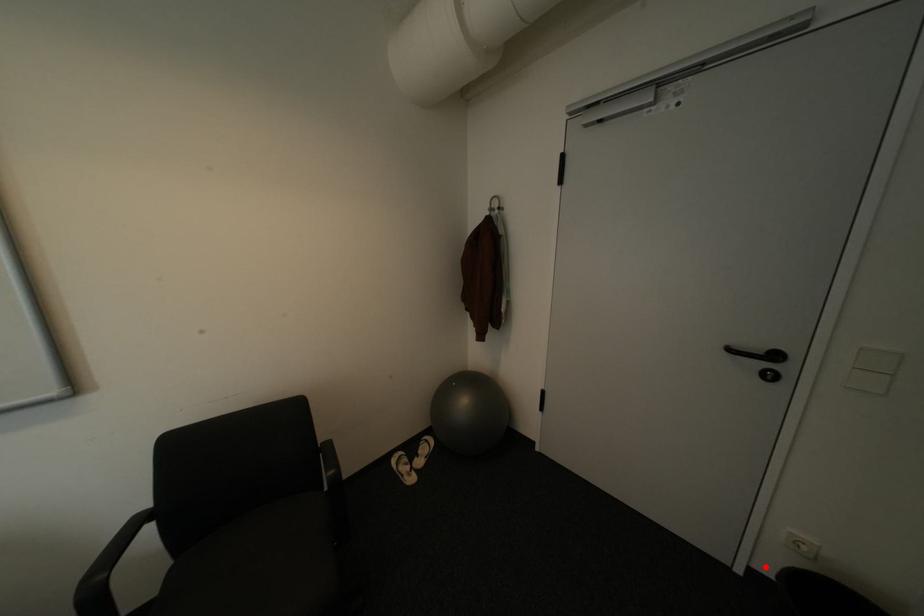
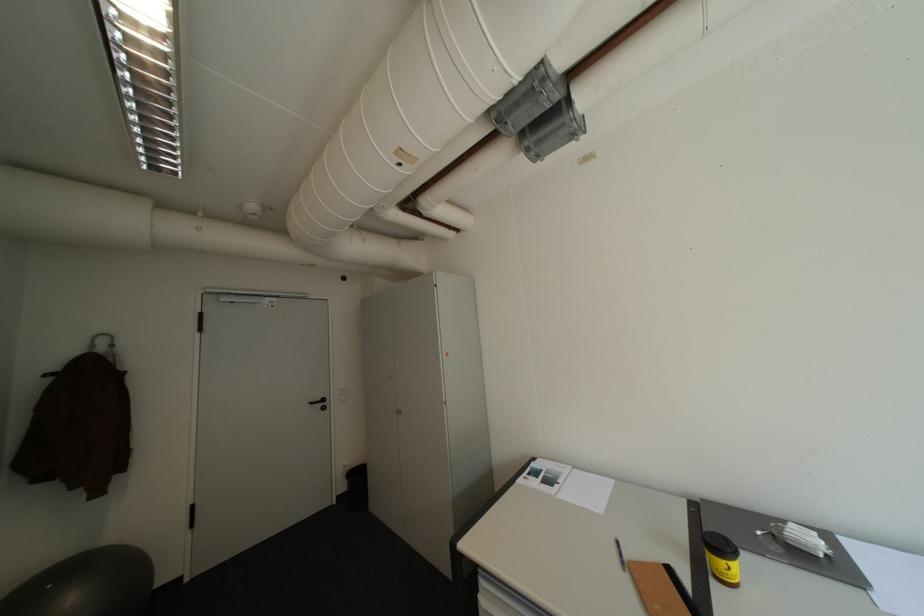
Question: I am providing you with two images of the same scene from different viewpoints. A red point is marked on the first image. Can you still see the location of the red point in image 2?

Choices:
 (A) Yes
 (B) No

Answer: (A)